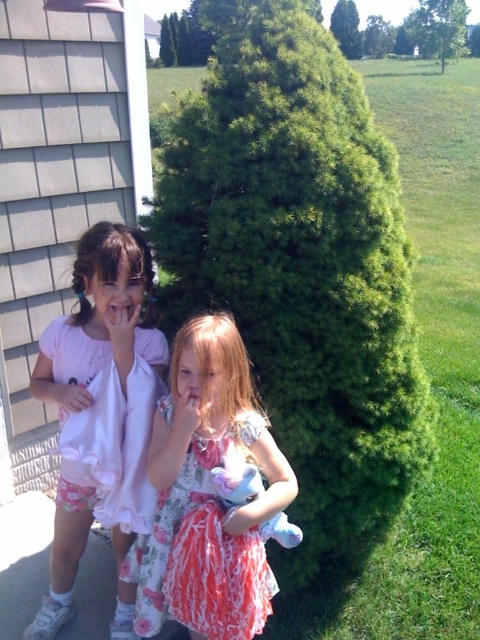
Does green leafy bush at center come behind floral dress at center?

That is True.

Can you confirm if green leafy bush at center is thinner than floral dress at center?

No.

You are a GUI agent. You are given a task and a screenshot of the screen. Output one action in this format:
    pyautogui.click(x=<x>, y=<y>)
    Task: Click on the green leafy bush at center
    The width and height of the screenshot is (480, 640).
    Given the screenshot: What is the action you would take?
    pyautogui.click(x=300, y=264)

What do you see at coordinates (300, 264) in the screenshot?
I see `green leafy bush at center` at bounding box center [300, 264].

Between green leafy bush at center and matte white shirt at left, which one has more height?

green leafy bush at center is taller.

This screenshot has height=640, width=480. I want to click on green leafy bush at center, so click(x=300, y=264).

Does green leafy bush at center have a smaller size compared to pink satin dress at left?

Actually, green leafy bush at center might be larger than pink satin dress at left.

Who is more forward, (176, 212) or (128, 486)?

Positioned in front is point (128, 486).

Locate an element on the screen. Image resolution: width=480 pixels, height=640 pixels. green leafy bush at center is located at coordinates (300, 264).